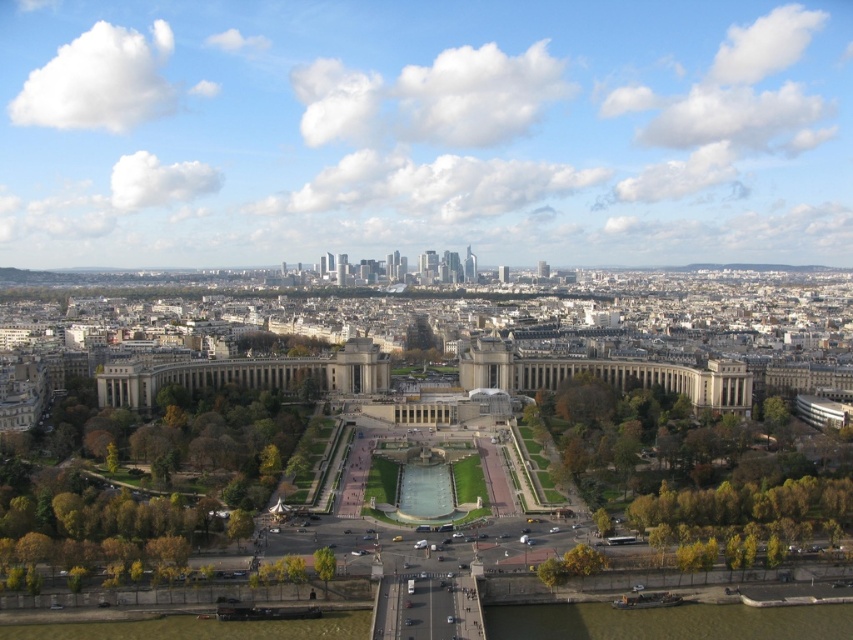
Question: Can you confirm if green leafy trees at lower left is bigger than white marble palace at center?

Choices:
 (A) yes
 (B) no

Answer: (A)

Question: Which point is closer to the camera?

Choices:
 (A) (357, 340)
 (B) (128, 531)
 (C) (683, 499)

Answer: (B)

Question: Which is farther from the green leafy tree at lower center?

Choices:
 (A) white marble palace at center
 (B) green leafy trees at center
 (C) green leafy trees at lower left

Answer: (A)

Question: Can you confirm if green leafy trees at center is positioned below white marble palace at center?

Choices:
 (A) yes
 (B) no

Answer: (A)

Question: Is green leafy trees at lower left wider than white marble palace at center?

Choices:
 (A) yes
 (B) no

Answer: (B)

Question: Which of these objects is positioned farthest from the green leafy trees at center?

Choices:
 (A) white marble palace at center
 (B) green leafy tree at lower center

Answer: (A)